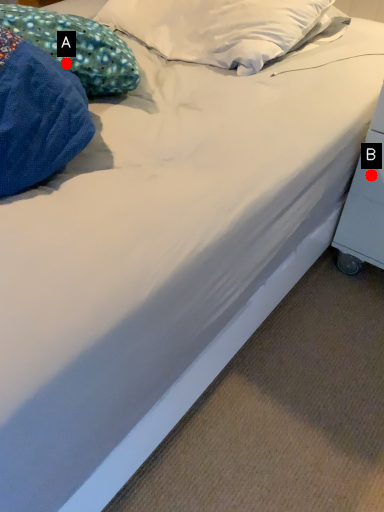
Question: Two points are circled on the image, labeled by A and B beside each circle. Which of the following is the farthest from the observer?

Choices:
 (A) A is further
 (B) B is further

Answer: (B)